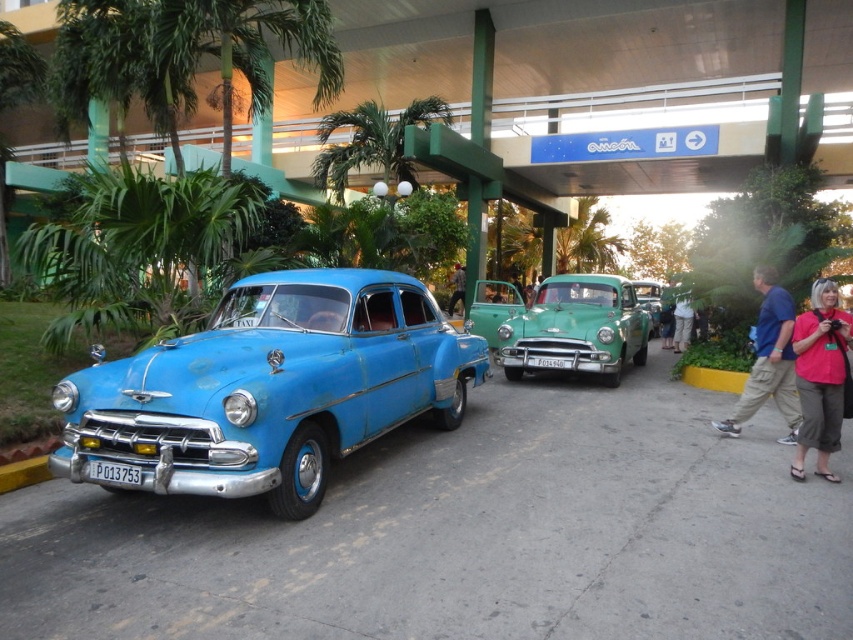
Is point (233, 380) farther from camera compared to point (685, 314)?

That is False.

Does matte blue car at center lie in front of brown leather pants at lower right?

Yes.

In order to click on matte blue car at center in this screenshot , I will do `click(268, 388)`.

Can you confirm if matte blue car at center is positioned below pink fabric shirt at right?

Actually, matte blue car at center is above pink fabric shirt at right.

Identify the location of matte blue car at center. (268, 388).

Which is behind, point (305, 458) or point (819, 314)?

The point (819, 314) is more distant.

The width and height of the screenshot is (853, 640). Identify the location of matte blue car at center. (268, 388).

Which is behind, point (764, 385) or point (691, 323)?

The point (691, 323) is behind.

Is point (778, 378) positioned behind point (683, 317)?

That is False.

This screenshot has height=640, width=853. In order to click on blue cotton shirt at right in this screenshot , I will do `click(769, 362)`.